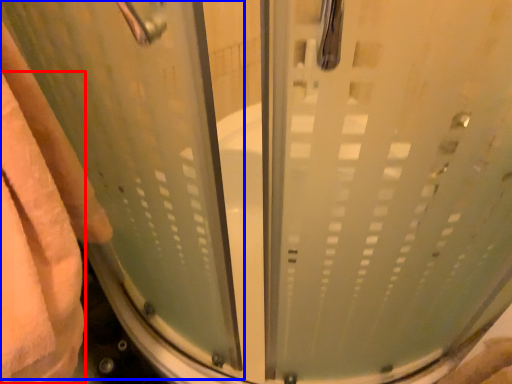
Question: Among these objects, which one is nearest to the camera, bath towel (highlighted by a red box) or screen door (highlighted by a blue box)?

Choices:
 (A) bath towel
 (B) screen door

Answer: (B)